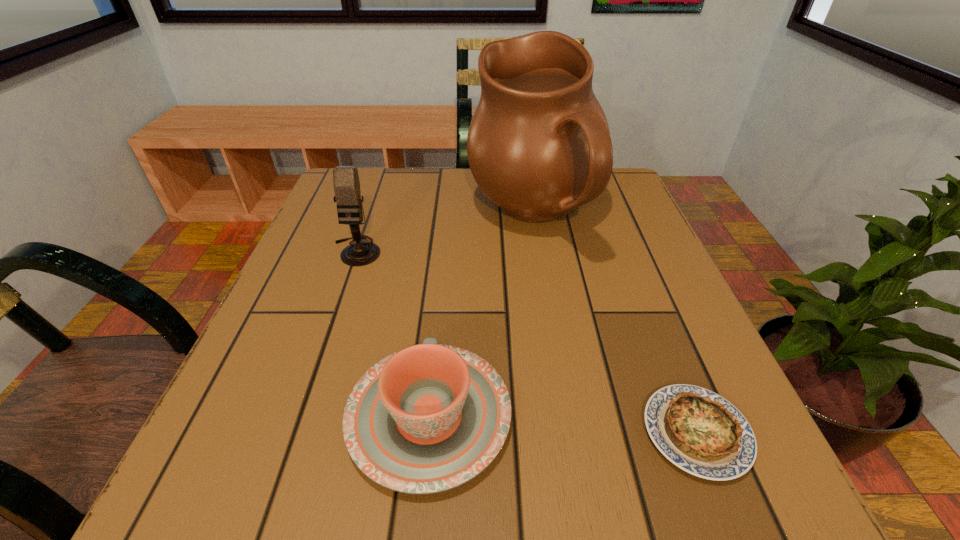
The width and height of the screenshot is (960, 540). I want to click on object at the near right corner, so click(699, 431).

Where is `free space at the far edge of the desktop`? free space at the far edge of the desktop is located at coordinates (402, 194).

Locate an element on the screen. The width and height of the screenshot is (960, 540). blank space at the left edge is located at coordinates click(274, 437).

You are a GUI agent. You are given a task and a screenshot of the screen. Output one action in this format:
    pyautogui.click(x=<x>, y=<y>)
    Task: Click on the free location at the right edge
    
    Given the screenshot: What is the action you would take?
    pyautogui.click(x=665, y=382)

At what (x,y) coordinates should I click in order to perform the action: click on vacant space at the far left corner of the desktop. Please return your answer as a coordinate pair (x, y). This screenshot has height=540, width=960. Looking at the image, I should click on (391, 193).

Where is `free space at the far right corner of the desktop`? The height and width of the screenshot is (540, 960). free space at the far right corner of the desktop is located at coordinates (616, 174).

This screenshot has width=960, height=540. What are the coordinates of `empty location between the shortest object and the second shortest object` in the screenshot? It's located at (563, 424).

Find the location of `vacant area that lies between the quiche and the cream pitcher`. vacant area that lies between the quiche and the cream pitcher is located at coordinates (615, 323).

At what (x,y) coordinates should I click in order to perform the action: click on vacant point located between the cream pitcher and the shortest object. Please return your answer as a coordinate pair (x, y). Looking at the image, I should click on (615, 323).

The image size is (960, 540). Find the location of `free spot between the chinaware and the quiche`. free spot between the chinaware and the quiche is located at coordinates (563, 424).